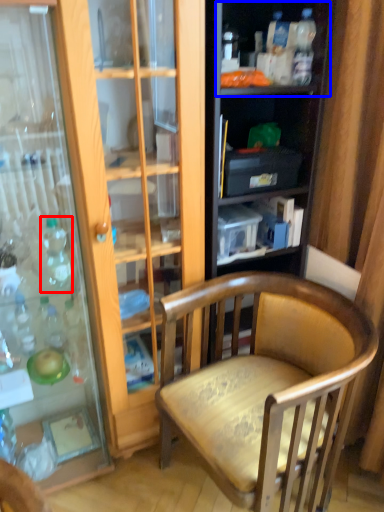
Question: Which point is closer to the camera, bottle (highlighted by a red box) or shelf (highlighted by a blue box)?

Choices:
 (A) bottle
 (B) shelf

Answer: (A)